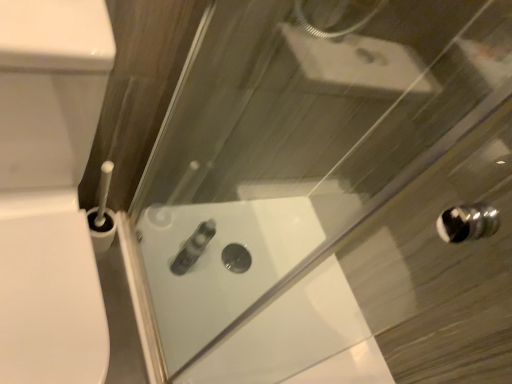
Identify the location of free space in front of satin silver tube at center. The image size is (512, 384). (168, 301).